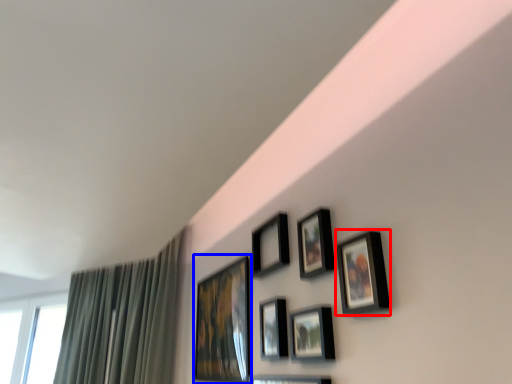
Question: Which of the following is the farthest to the observer, picture frame (highlighted by a red box) or picture frame (highlighted by a blue box)?

Choices:
 (A) picture frame
 (B) picture frame

Answer: (B)